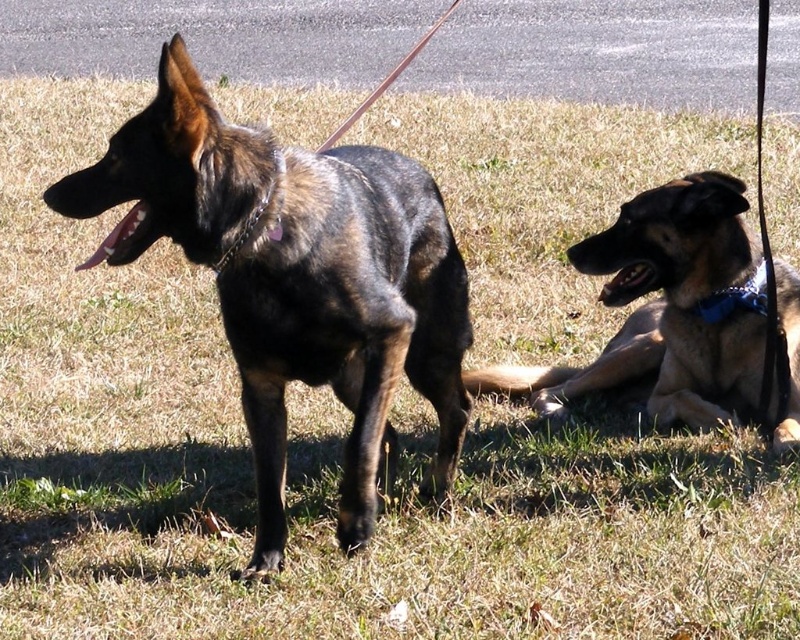
Who is more distant from viewer, [788,388] or [700,307]?

The point [700,307] is behind.

Does brown fur dog at lower right have a larger size compared to blue fabric neckband at right?

Indeed, brown fur dog at lower right has a larger size compared to blue fabric neckband at right.

At what (x,y) coordinates should I click in order to perform the action: click on brown fur dog at lower right. Please return your answer as a coordinate pair (x, y). The height and width of the screenshot is (640, 800). Looking at the image, I should click on (664, 307).

Does point (316, 154) come behind point (732, 300)?

No, (316, 154) is in front of (732, 300).

This screenshot has height=640, width=800. Find the location of `brindle fur dog at center`. brindle fur dog at center is located at coordinates (296, 276).

I want to click on brindle fur dog at center, so click(x=296, y=276).

Identify the location of brindle fur dog at center. This screenshot has width=800, height=640. (296, 276).

Locate an element on the screen. brindle fur dog at center is located at coordinates (296, 276).

Does point (146, 163) come farther from viewer compared to point (588, 268)?

No, (146, 163) is in front of (588, 268).

Which is behind, point (264, 148) or point (678, 234)?

The point (678, 234) is behind.

Where is `brindle fur dog at center`? brindle fur dog at center is located at coordinates click(296, 276).